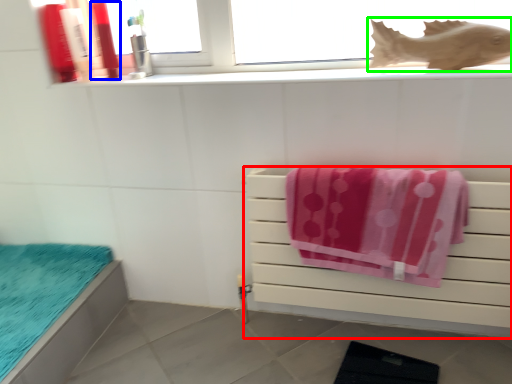
Question: Estimate the real-world distances between objects in this image. Which object is closer to furniture (highlighted by a red box), toiletry (highlighted by a blue box) or fish (highlighted by a green box)?

Choices:
 (A) toiletry
 (B) fish

Answer: (B)